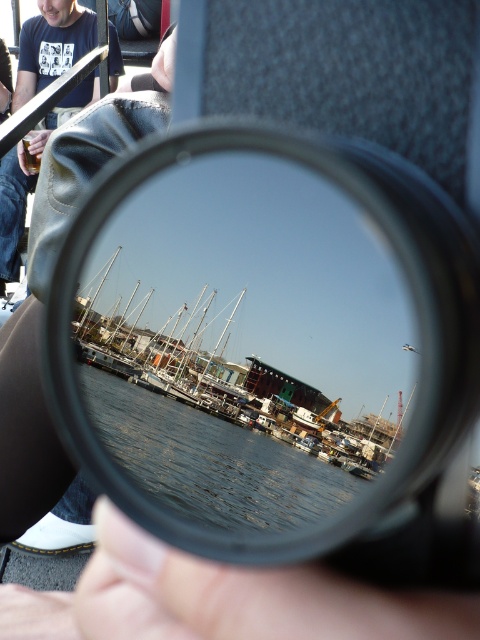
Consider the image. Does transparent plastic lens at center have a lesser width compared to dark blue leather jacket at upper left?

Incorrect, transparent plastic lens at center's width is not less than dark blue leather jacket at upper left's.

Image resolution: width=480 pixels, height=640 pixels. Identify the location of transparent plastic lens at center. (271, 328).

Is point (180, 577) closer to camera compared to point (9, 182)?

Yes.

Describe the element at coordinates (243, 596) in the screenshot. I see `smooth skin hand at center` at that location.

Is point (468, 621) in front of point (46, 12)?

Yes, it is in front of point (46, 12).

Find the location of a particular element. Image resolution: width=480 pixels, height=640 pixels. smooth skin hand at center is located at coordinates (243, 596).

Is point (297, 144) more distant than point (248, 406)?

No, it is in front of (248, 406).

Does transparent plastic lens at center lie behind clear water at center?

No, it is in front of clear water at center.

Who is more forward, (294, 500) or (117, 424)?

Point (294, 500) is more forward.

Where is `transparent plastic lens at center`? transparent plastic lens at center is located at coordinates (271, 328).